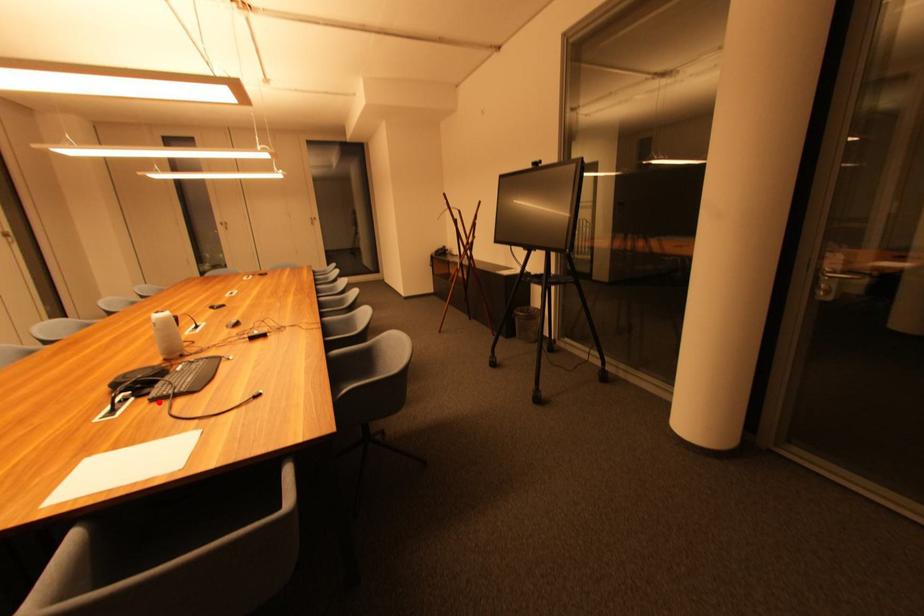
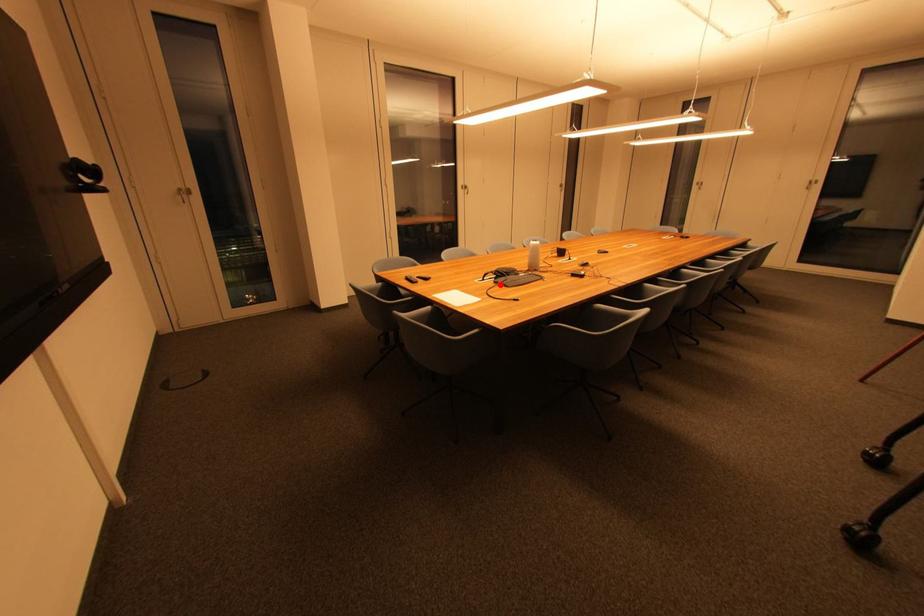
I am providing you with two images of the same scene from different viewpoints. A red point is marked on the first image and another point is marked on the second image. Is the marked point in image1 the same physical position as the marked point in image2?

Yes